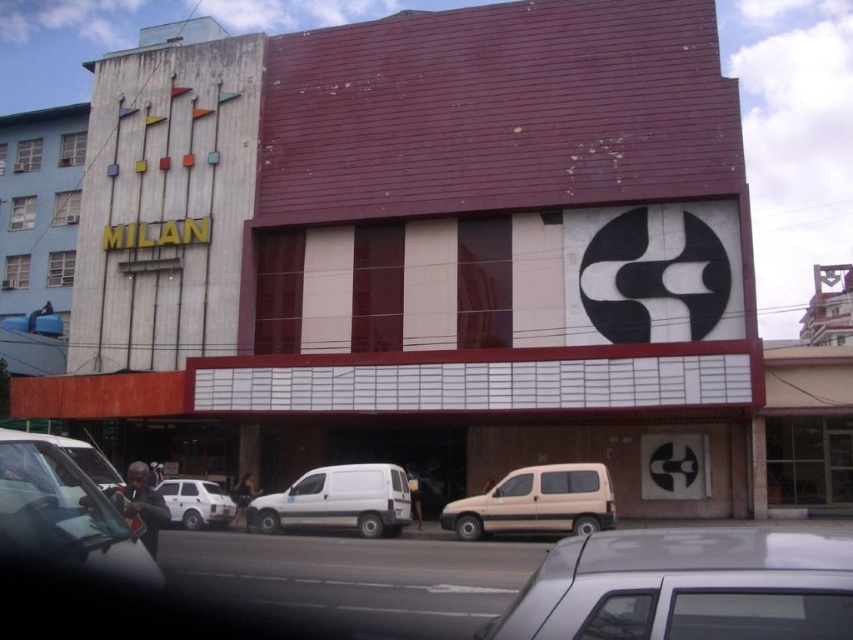
Can you confirm if metallic silver car at center is wider than metallic silver car at lower left?

Correct, the width of metallic silver car at center exceeds that of metallic silver car at lower left.

Who is taller, metallic silver car at center or metallic silver car at lower left?

metallic silver car at center is taller.

This screenshot has width=853, height=640. In order to click on metallic silver car at center in this screenshot , I will do `click(685, 586)`.

In order to click on metallic silver car at center in this screenshot , I will do `click(685, 586)`.

Between metallic silver car at lower left and white matte van at center, which one is positioned higher?

Positioned higher is metallic silver car at lower left.

The image size is (853, 640). Describe the element at coordinates (62, 509) in the screenshot. I see `metallic silver car at lower left` at that location.

Locate an element on the screen. metallic silver car at lower left is located at coordinates (62, 509).

Who is more forward, (578,474) or (343,483)?

Point (578,474)

Does point (541, 508) come behind point (305, 477)?

No, it is not.

This screenshot has height=640, width=853. I want to click on beige matte van at center, so click(x=537, y=502).